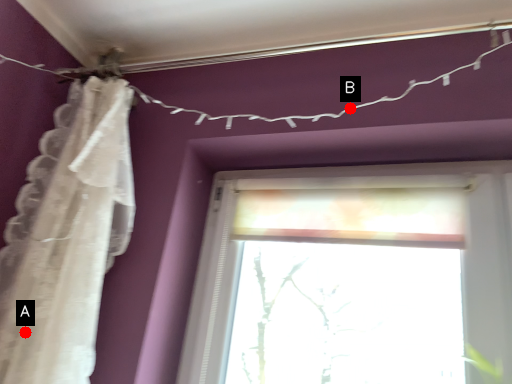
Question: Two points are circled on the image, labeled by A and B beside each circle. Which point is further to the camera?

Choices:
 (A) A is further
 (B) B is further

Answer: (B)